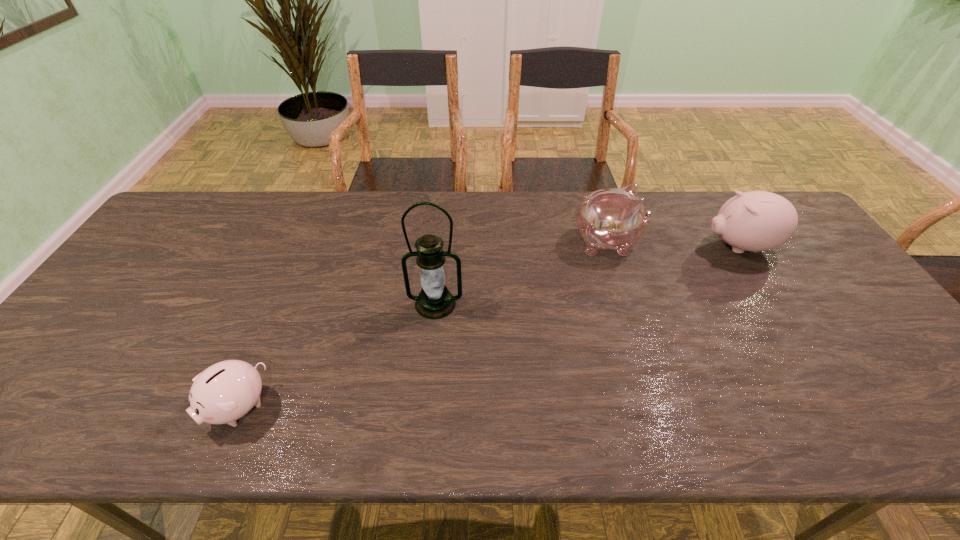
Find the location of a particular element. The width and height of the screenshot is (960, 540). free spot located 0.100m at the snout of the rightmost object is located at coordinates (669, 246).

The width and height of the screenshot is (960, 540). I want to click on vacant space positioned 0.090m on the right of the leftmost piggy bank, so click(x=309, y=408).

Find the location of `object that is at the near edge`. object that is at the near edge is located at coordinates (226, 391).

In order to click on object that is at the right edge in this screenshot , I will do [x=755, y=221].

Locate an element on the screen. This screenshot has height=540, width=960. object situated at the far right corner is located at coordinates (755, 221).

Find the location of `vacant space at the far edge of the desktop`. vacant space at the far edge of the desktop is located at coordinates (521, 233).

This screenshot has width=960, height=540. Identify the location of free location at the near edge. (643, 406).

The height and width of the screenshot is (540, 960). Find the location of `blank space at the left edge of the desktop`. blank space at the left edge of the desktop is located at coordinates (109, 327).

In order to click on free space at the right edge of the desktop in this screenshot , I will do `click(790, 280)`.

Where is `unoccupied position between the second piggy bank from right to left and the rightmost piggy bank`? This screenshot has width=960, height=540. unoccupied position between the second piggy bank from right to left and the rightmost piggy bank is located at coordinates (673, 245).